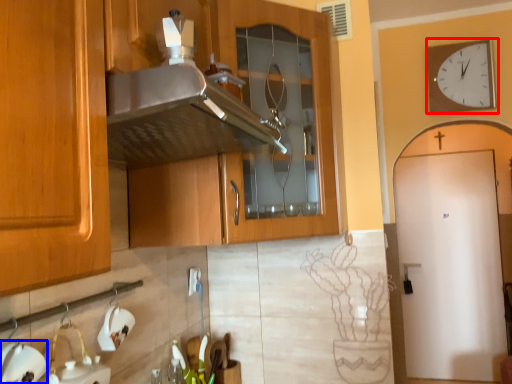
Question: Which point is closer to the camera, wall clock (highlighted by a red box) or appliance (highlighted by a blue box)?

Choices:
 (A) wall clock
 (B) appliance

Answer: (B)